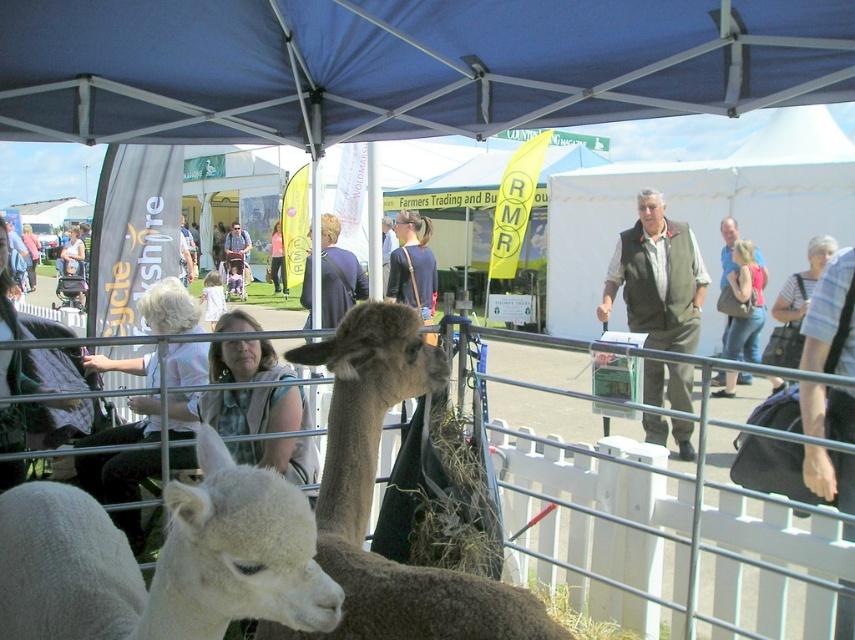
Question: Based on their relative distances, which object is farther from the light brown hair at center?

Choices:
 (A) metal wire fence at center
 (B) light brown hair at upper left

Answer: (A)

Question: Does white fabric at left appear on the right side of denim jacket at upper right?

Choices:
 (A) yes
 (B) no

Answer: (B)

Question: Which object is positioned closest to the brown woolen alpaca at center?

Choices:
 (A) light brown leather jacket at center
 (B) light brown hair at center
 (C) blue fabric canopy at upper center
 (D) striped fabric shirt at center

Answer: (C)

Question: Can you confirm if metal wire fence at center is wider than green textured vest at center?

Choices:
 (A) yes
 (B) no

Answer: (A)

Question: Can you confirm if green textured vest at center is bigger than light brown hair at center?

Choices:
 (A) yes
 (B) no

Answer: (B)

Question: Which point is farther to the camera?

Choices:
 (A) pyautogui.click(x=301, y=301)
 (B) pyautogui.click(x=276, y=285)

Answer: (B)